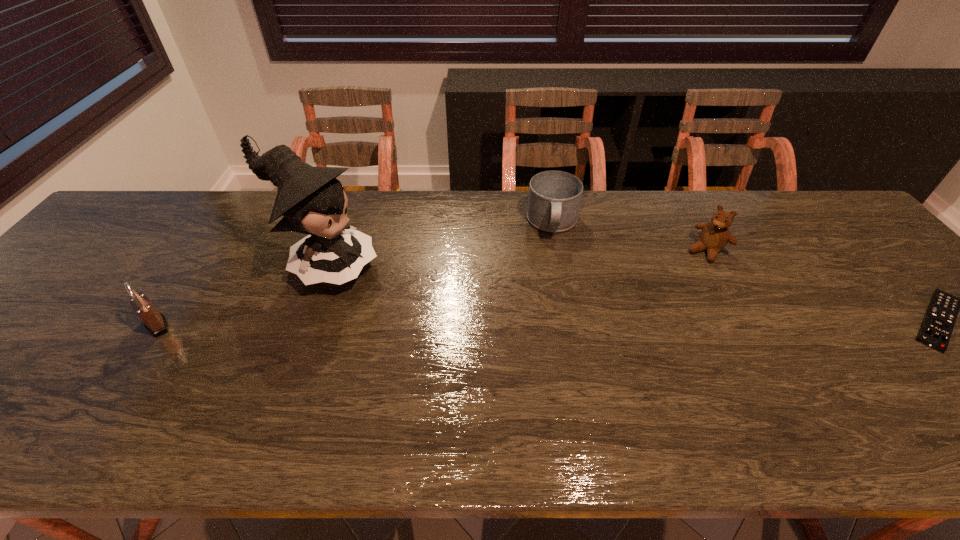
Locate an element on the screen. This screenshot has height=540, width=960. padlock is located at coordinates (155, 322).

Where is `the third object from left to right`? The image size is (960, 540). the third object from left to right is located at coordinates (554, 199).

Locate an element on the screen. the second object from left to right is located at coordinates (311, 199).

Locate an element on the screen. doll is located at coordinates (311, 199).

Where is `teddy bear`? The width and height of the screenshot is (960, 540). teddy bear is located at coordinates (714, 236).

Where is `free space located 0.260m on the back of the padlock`? The width and height of the screenshot is (960, 540). free space located 0.260m on the back of the padlock is located at coordinates (211, 243).

This screenshot has width=960, height=540. I want to click on free point located 0.160m on the side of the mug with the handle, so click(x=555, y=286).

Where is `vacant space located 0.270m on the side of the mug with the handle`? Image resolution: width=960 pixels, height=540 pixels. vacant space located 0.270m on the side of the mug with the handle is located at coordinates (555, 319).

At what (x,y) coordinates should I click in order to perform the action: click on vacant space located on the side of the mug with the handle. Please return your answer as a coordinate pair (x, y). Looking at the image, I should click on (555, 339).

This screenshot has height=540, width=960. Identify the location of free space located at the face of the tallest object. (441, 315).